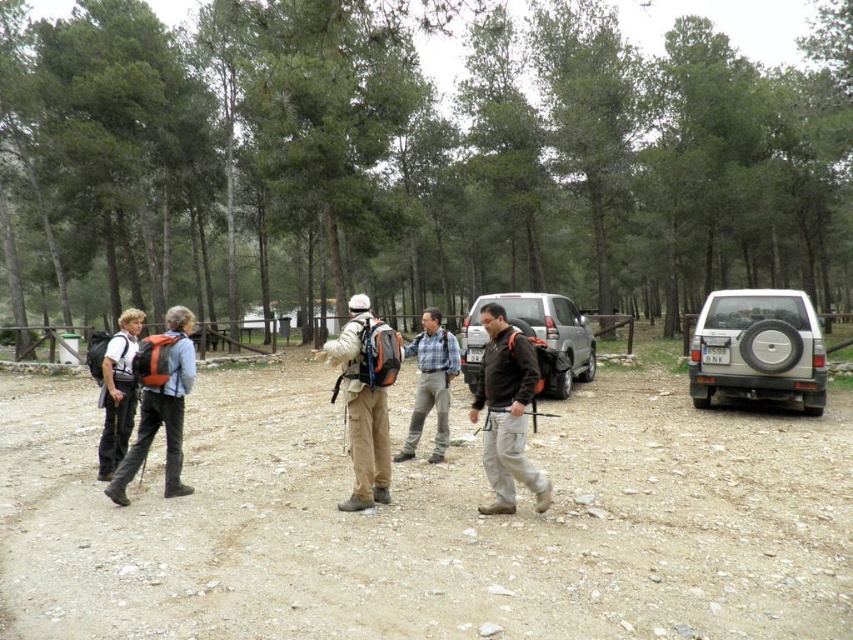
Question: Can you confirm if matte khaki pants at center is positioned to the left of matte black backpack at left?

Choices:
 (A) no
 (B) yes

Answer: (A)

Question: Which point appears farthest from the camera in this image?

Choices:
 (A) (444, 374)
 (B) (38, 499)

Answer: (A)

Question: Is dark brown leather jacket at center to the left of plaid fabric shirt at center from the viewer's perspective?

Choices:
 (A) no
 (B) yes

Answer: (A)

Question: Which object is closer to the camera taking this photo?

Choices:
 (A) plaid fabric shirt at center
 (B) matte black backpack at left

Answer: (B)

Question: Does green leafy tree at center appear on the left side of silver metallic jeep at center?

Choices:
 (A) no
 (B) yes

Answer: (A)

Question: Which point is farther to the camera?

Choices:
 (A) (735, 250)
 (B) (801, 324)
 (C) (500, 460)

Answer: (A)